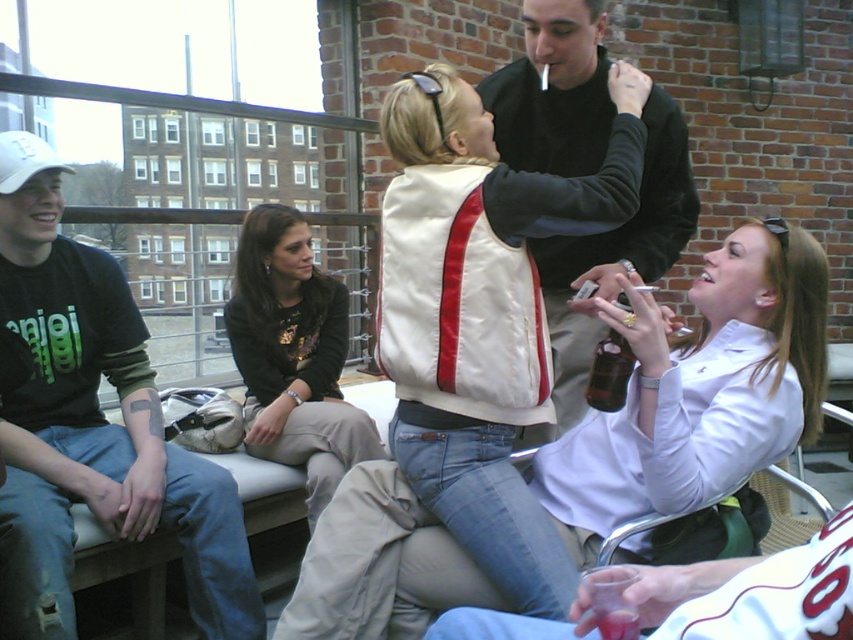
How much distance is there between dark green t-shirt at left and velvet black jacket at upper center?

dark green t-shirt at left and velvet black jacket at upper center are 1.16 meters apart.

Is dark green t-shirt at left thinner than velvet black jacket at upper center?

No, dark green t-shirt at left is not thinner than velvet black jacket at upper center.

What do you see at coordinates (96, 426) in the screenshot?
I see `dark green t-shirt at left` at bounding box center [96, 426].

Where is `dark green t-shirt at left`? This screenshot has width=853, height=640. dark green t-shirt at left is located at coordinates (96, 426).

Does point (67, 300) come behind point (310, 400)?

No, (67, 300) is closer to viewer.

Between point (1, 406) and point (279, 461), which one is positioned in front?

Point (1, 406) is in front.

I want to click on dark green t-shirt at left, so click(x=96, y=426).

Is white leather jacket at center thinner than dark green t-shirt at left?

No, white leather jacket at center is not thinner than dark green t-shirt at left.

Which is in front, point (338, 540) or point (33, 276)?

Point (338, 540) is in front.

Locate an element on the screen. white leather jacket at center is located at coordinates (697, 390).